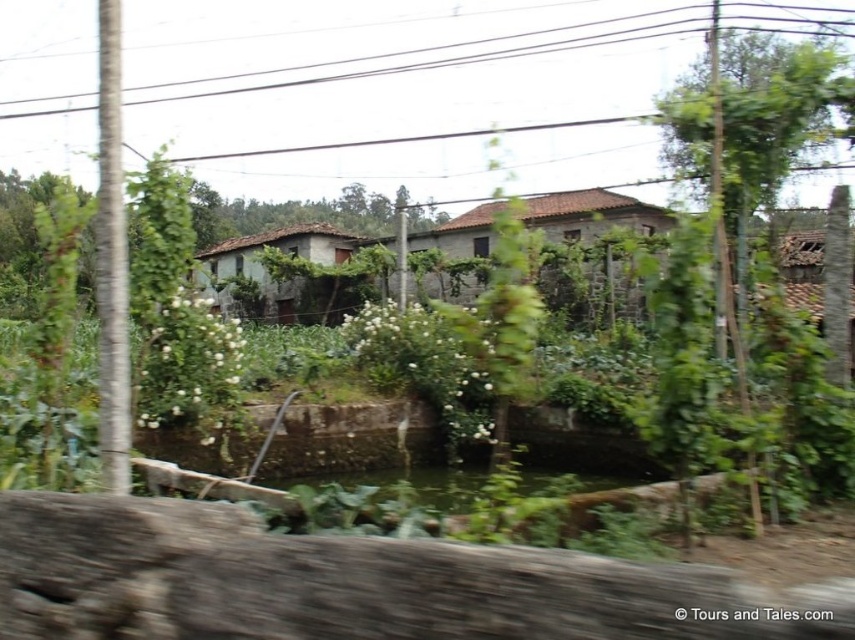
Is black wire at upper center in front of stone textured house at center?

Yes, black wire at upper center is closer to the viewer.

In the scene shown: Does black wire at upper center have a larger size compared to stone textured house at center?

Yes.

Is point (685, 32) in front of point (423, 234)?

No, (685, 32) is behind (423, 234).

Locate an element on the screen. The height and width of the screenshot is (640, 855). black wire at upper center is located at coordinates (458, 58).

Is black wire at upper center wider than rustic stone house at center?

Yes.

Who is more forward, (275, 83) or (215, 248)?

Point (215, 248) is more forward.

Does point (404, 52) lie in front of point (337, 250)?

No, (404, 52) is behind (337, 250).

You are a GUI agent. You are given a task and a screenshot of the screen. Output one action in this format:
    pyautogui.click(x=<x>, y=<y>)
    Task: Click on the black wire at upper center
    The width and height of the screenshot is (855, 640).
    Given the screenshot: What is the action you would take?
    pyautogui.click(x=458, y=58)

How far apart are stone textured house at center and rustic stone house at center?

stone textured house at center and rustic stone house at center are 28.12 feet apart from each other.

Between point (573, 195) and point (298, 228), which one is positioned in front?

Positioned in front is point (573, 195).

Is point (573, 236) behind point (207, 276)?

No, it is not.

Identify the location of stone textured house at center. This screenshot has width=855, height=640. (591, 216).